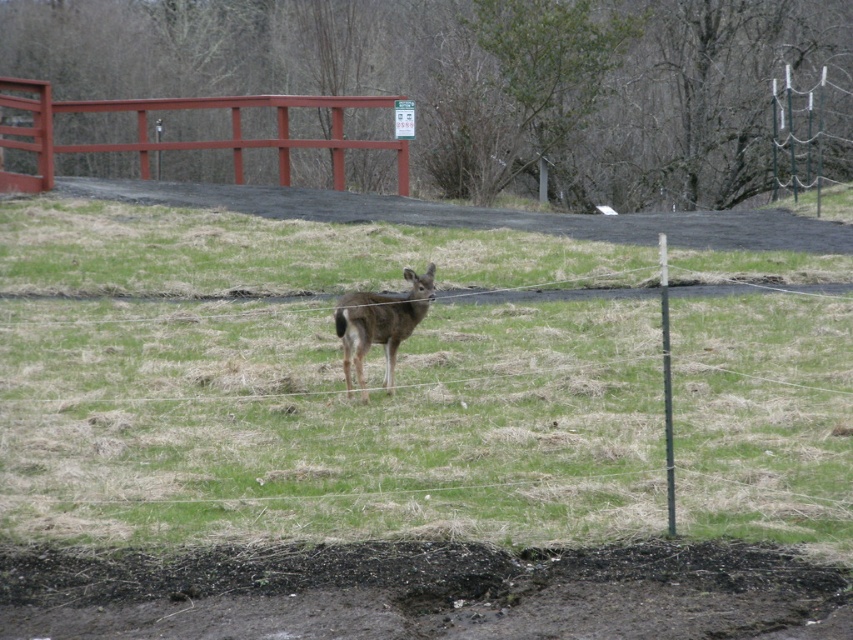
Question: Which object is closer to the camera taking this photo?

Choices:
 (A) smooth wooden fence at upper center
 (B) green grassy at center

Answer: (B)

Question: Can you confirm if green grassy at center is wider than brown matte deer at center?

Choices:
 (A) no
 (B) yes

Answer: (B)

Question: Which point is farther to the camera?

Choices:
 (A) (369, 307)
 (B) (402, 182)
 (C) (238, 419)

Answer: (B)

Question: Which point appears closest to the camera in this image?

Choices:
 (A) (236, 172)
 (B) (349, 356)
 (C) (209, 493)

Answer: (C)

Question: From the image, what is the correct spatial relationship of smooth wooden fence at upper center in relation to brown matte deer at center?

Choices:
 (A) below
 (B) above

Answer: (B)

Question: Is green grassy at center below smooth wooden fence at upper center?

Choices:
 (A) yes
 (B) no

Answer: (A)